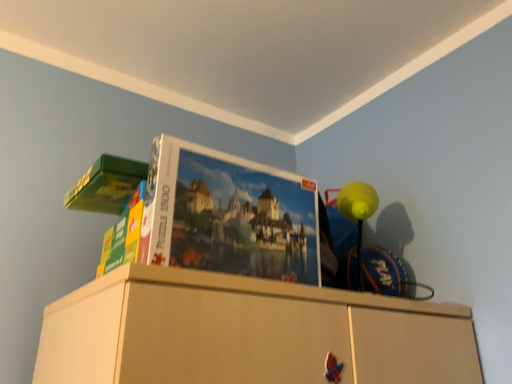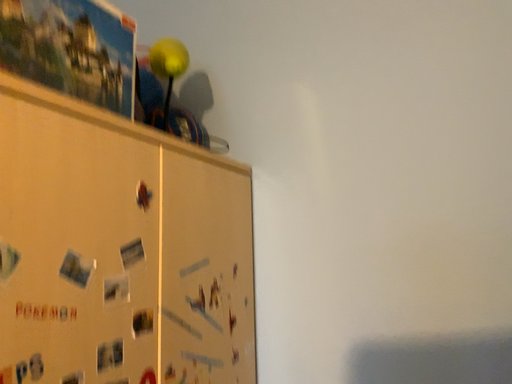
Question: Which way did the camera rotate in the video?

Choices:
 (A) rotated right
 (B) rotated left

Answer: (A)